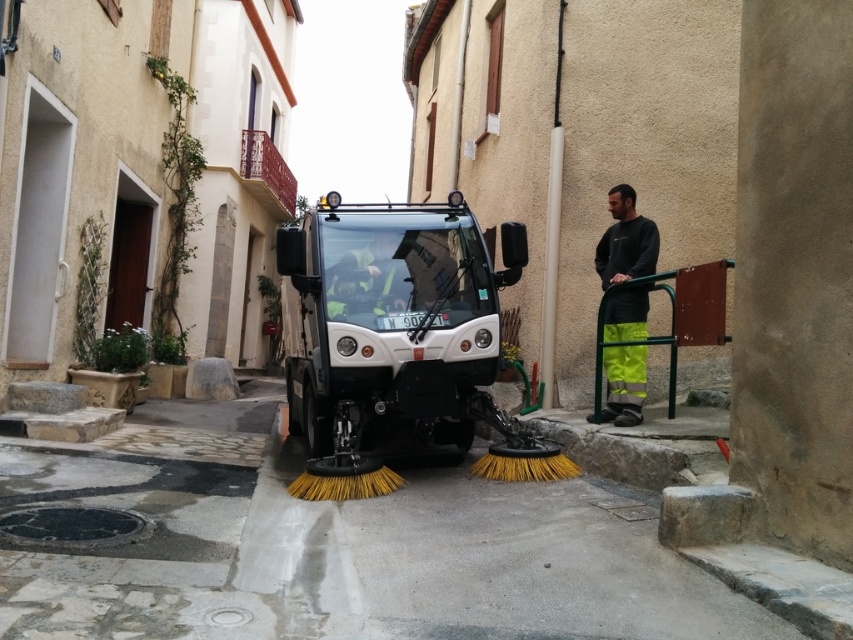
Question: Which is farther from the white matte garbage truck at center?

Choices:
 (A) reflective yellow vest at center
 (B) dark gray sweatshirt at right

Answer: (B)

Question: Is white matte garbage truck at center to the left of dark gray sweatshirt at right from the viewer's perspective?

Choices:
 (A) yes
 (B) no

Answer: (A)

Question: Can you confirm if white matte garbage truck at center is smaller than reflective yellow vest at center?

Choices:
 (A) yes
 (B) no

Answer: (B)

Question: Does white matte garbage truck at center have a smaller size compared to reflective yellow vest at center?

Choices:
 (A) yes
 (B) no

Answer: (B)

Question: Which point is closer to the camera?

Choices:
 (A) white matte garbage truck at center
 (B) reflective yellow vest at center
 (C) dark gray sweatshirt at right

Answer: (A)

Question: Which point is farther from the camera taking this photo?

Choices:
 (A) (337, 260)
 (B) (639, 253)
 (C) (368, 278)

Answer: (B)